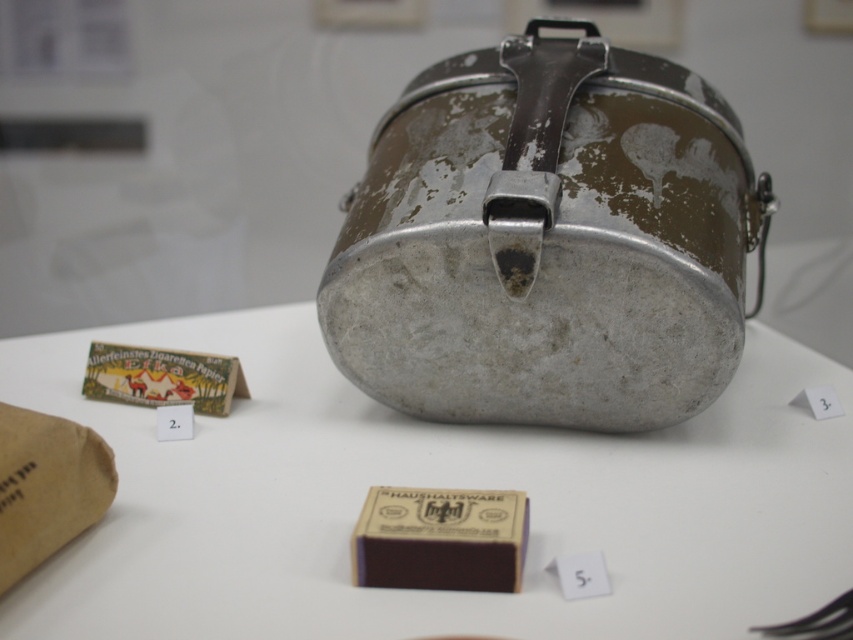
Question: Is metallic silver container at center to the right of brown paper bag at lower left from the viewer's perspective?

Choices:
 (A) no
 (B) yes

Answer: (B)

Question: Is dirty metallic lunchbox at center to the left of brown paper bag at lower left from the viewer's perspective?

Choices:
 (A) no
 (B) yes

Answer: (A)

Question: Considering the real-world distances, which object is closest to the brown paper bag at lower left?

Choices:
 (A) metallic silver container at center
 (B) dirty metallic lunchbox at center

Answer: (A)

Question: Which of the following is the closest to the observer?

Choices:
 (A) metallic silver container at center
 (B) dirty metallic lunchbox at center
 (C) brown paper bag at lower left

Answer: (A)

Question: Which of the following is the closest to the observer?

Choices:
 (A) (775, 353)
 (B) (502, 97)

Answer: (B)

Question: Can you confirm if metallic silver container at center is positioned to the right of dirty metallic lunchbox at center?

Choices:
 (A) yes
 (B) no

Answer: (B)